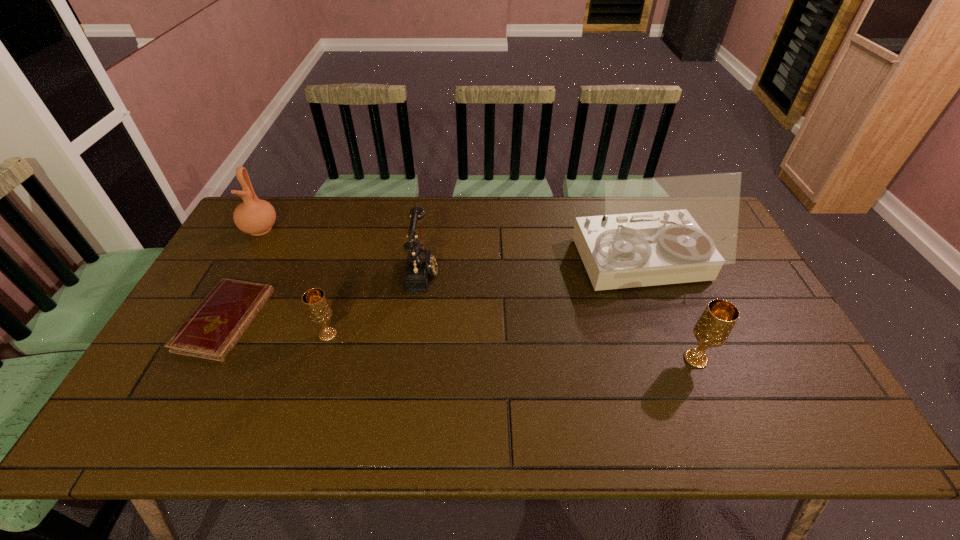
To ensure equal spacing by inserting another chalice among them, please point out a vacant spot for this new chalice. Please provide its 2D coordinates. Your answer should be formatted as a tuple, i.e. [(x, y)], where the tuple contains the x and y coordinates of a point satisfying the conditions above.

[(508, 346)]